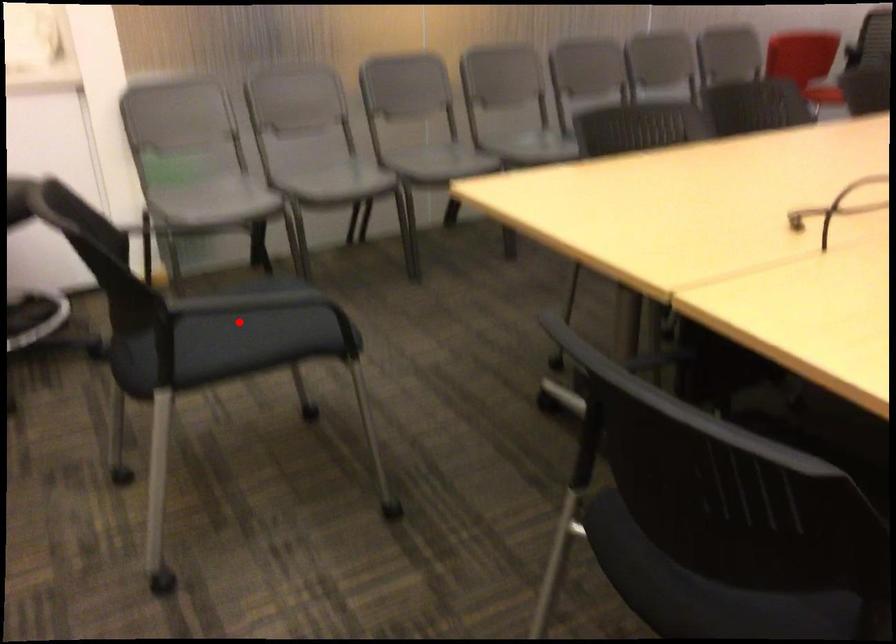
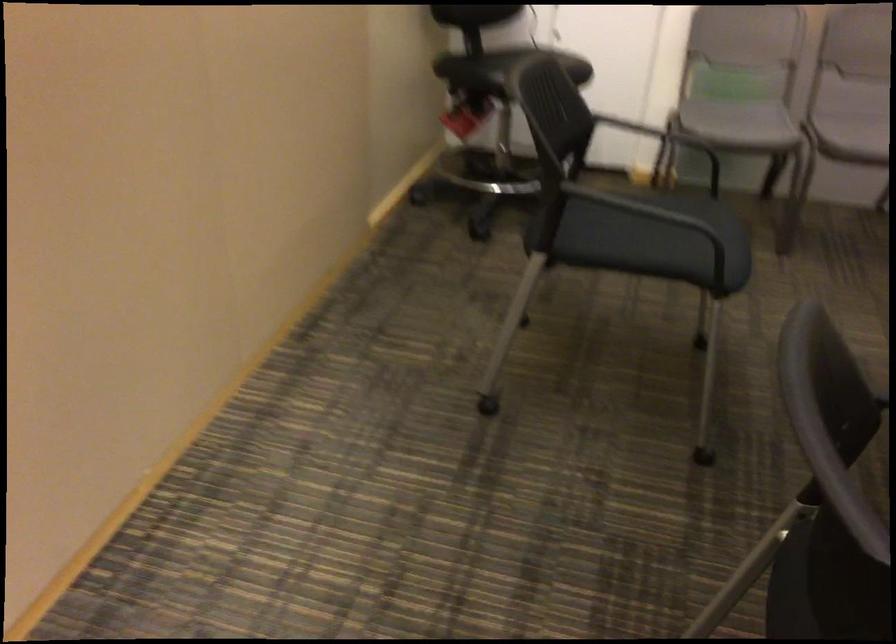
Find the pixel in the second image that matches the highlighted location in the first image.

(657, 222)